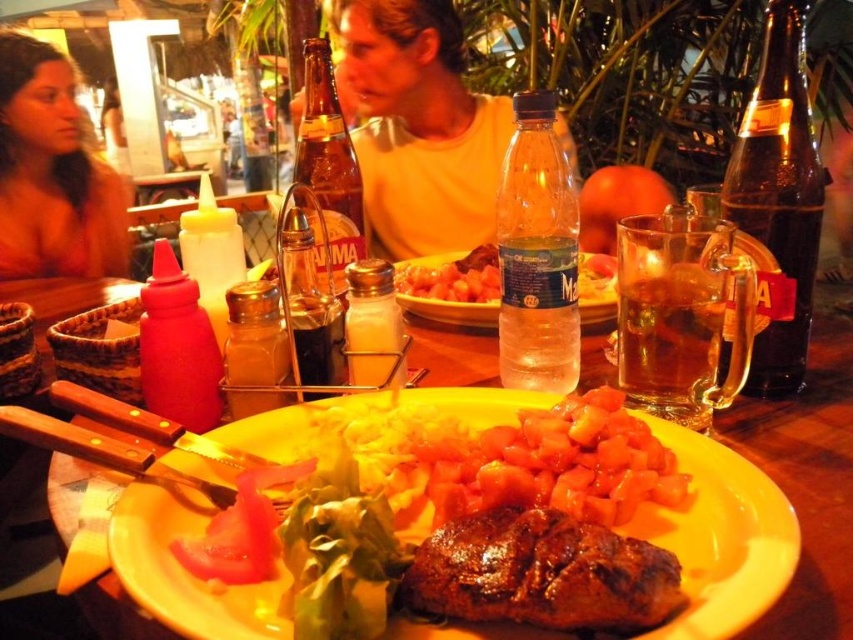
You are sitting at the table and want to reach both the knife and the mug. Which object is closer to you, the point at (724, 240) or the point at (229, 365)?

The point at (724, 240) is closer to you because it is in front of the point at (229, 365).